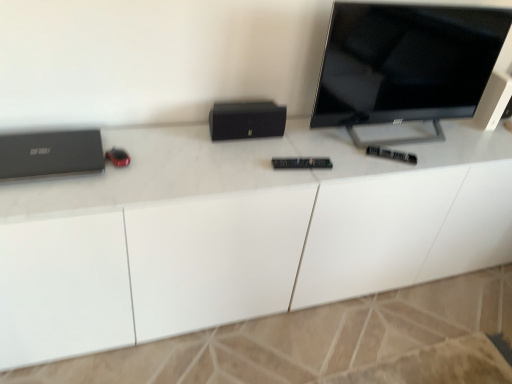
The image size is (512, 384). What are the coordinates of `free space that is to the left of black matte speaker at center` in the screenshot? It's located at (184, 140).